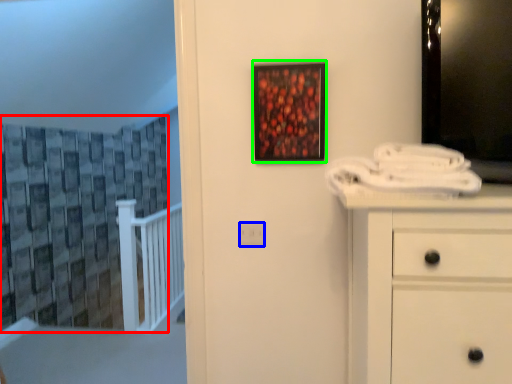
Question: Which is nearer to the curtain (highlighted by a red box)? electric outlet (highlighted by a blue box) or picture frame (highlighted by a green box).

Choices:
 (A) electric outlet
 (B) picture frame

Answer: (B)